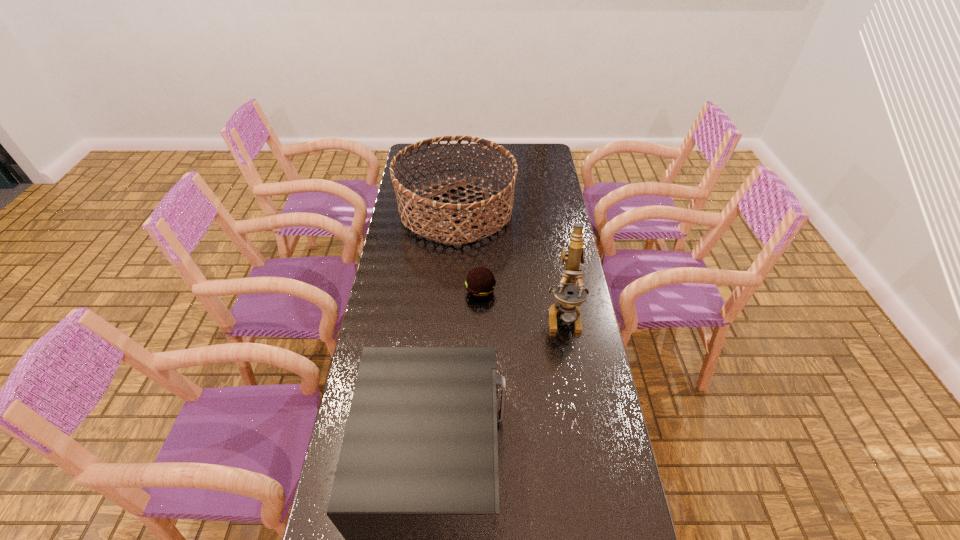
Where is `free point at the left edge`? Image resolution: width=960 pixels, height=540 pixels. free point at the left edge is located at coordinates (387, 310).

Locate an element on the screen. free space at the right edge of the desktop is located at coordinates (586, 410).

Where is `vacant space at the far right corner of the desktop`? The image size is (960, 540). vacant space at the far right corner of the desktop is located at coordinates (536, 149).

Locate an element on the screen. The width and height of the screenshot is (960, 540). free space between the microscope and the basket is located at coordinates (511, 263).

You are a GUI agent. You are given a task and a screenshot of the screen. Output one action in this format:
    pyautogui.click(x=<x>, y=<y>)
    Task: Click on the empty space between the patty and the microscope
    The height and width of the screenshot is (540, 960).
    Given the screenshot: What is the action you would take?
    pyautogui.click(x=522, y=303)

Locate an element on the screen. The image size is (960, 540). empty space that is in between the patty and the tallest object is located at coordinates (522, 303).

Select which object appears as the closest to the farthest object. Please provide its 2D coordinates. Your answer should be formatted as a tuple, i.e. [(x, y)], where the tuple contains the x and y coordinates of a point satisfying the conditions above.

[(480, 282)]

Choose which object is the second nearest neighbor to the shortest object. Please provide its 2D coordinates. Your answer should be formatted as a tuple, i.e. [(x, y)], where the tuple contains the x and y coordinates of a point satisfying the conditions above.

[(567, 303)]

Where is `vacant space that satisfies the following two spatial constraints: 1. on the front side of the tallest object; 2. on the left side of the patty`? vacant space that satisfies the following two spatial constraints: 1. on the front side of the tallest object; 2. on the left side of the patty is located at coordinates (480, 315).